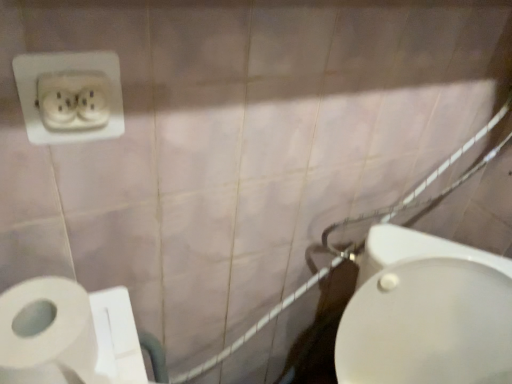
Question: Do you think white glossy bidet at lower right is within white ceramic shower at right, or outside of it?

Choices:
 (A) outside
 (B) inside

Answer: (A)

Question: In terms of width, does white glossy bidet at lower right look wider or thinner when compared to white ceramic shower at right?

Choices:
 (A) thin
 (B) wide

Answer: (B)

Question: Which is nearer to the white plastic power plugs and sockets at upper left?

Choices:
 (A) white matte toilet paper at lower left
 (B) white ceramic shower at right
 (C) white glossy bidet at lower right

Answer: (A)

Question: Based on their relative distances, which object is nearer to the white plastic power plugs and sockets at upper left?

Choices:
 (A) white glossy bidet at lower right
 (B) white matte toilet paper at lower left
 (C) white ceramic shower at right

Answer: (B)